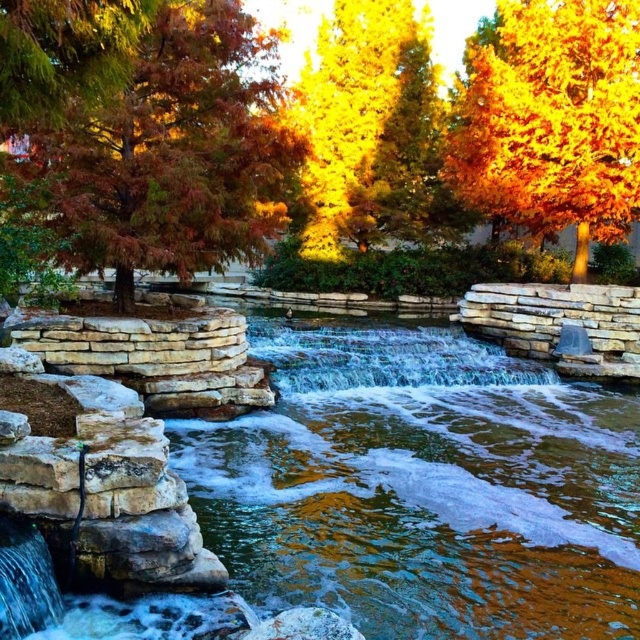
Question: Which point is farther to the camera?

Choices:
 (A) (332, 115)
 (B) (406, 355)
 (C) (608, 129)
 (D) (184, 195)

Answer: (A)

Question: Which object appears closest to the camera in this image?

Choices:
 (A) matte reddish-brown tree at left
 (B) golden yellow leaves at upper right
 (C) golden yellow leaves at upper center

Answer: (A)

Question: Does golden yellow leaves at upper right come behind golden yellow leaves at upper center?

Choices:
 (A) yes
 (B) no

Answer: (A)

Question: Is golden yellow leaves at upper right to the right of golden yellow leaves at upper center from the viewer's perspective?

Choices:
 (A) no
 (B) yes

Answer: (B)

Question: Can you confirm if golden yellow leaves at upper right is smaller than golden yellow leaves at upper center?

Choices:
 (A) yes
 (B) no

Answer: (A)

Question: Which of the following is the closest to the observer?

Choices:
 (A) golden yellow leaves at upper right
 (B) translucent glass waterfall at center
 (C) golden yellow leaves at upper center

Answer: (B)